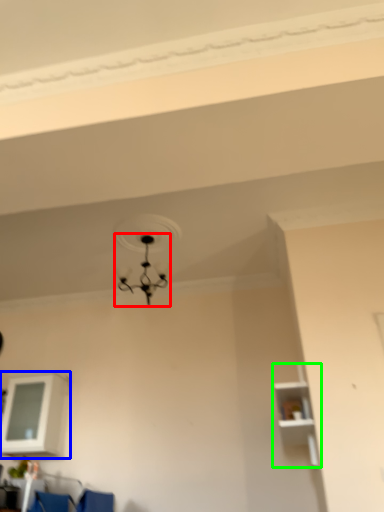
Question: Which is farther away from lamp (highlighted by a red box)? shelf (highlighted by a blue box) or shelf (highlighted by a green box)?

Choices:
 (A) shelf
 (B) shelf

Answer: (B)